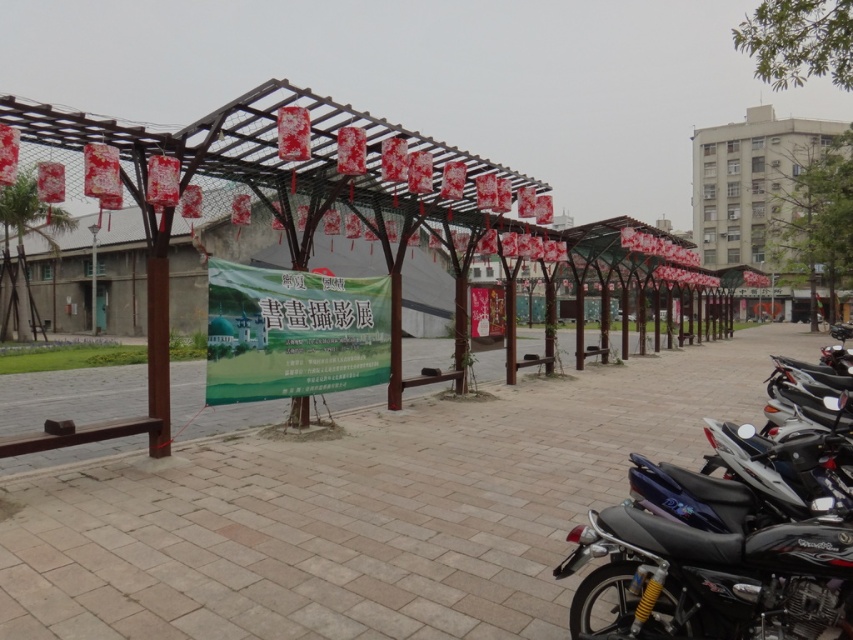
You are a photographer standing at the camera position. You want to take a photo of the black glossy motorcycle at right. Is the motorcycle within your reach to adjust its position before taking the photo?

The black glossy motorcycle at right is 7.38 feet away from the camera. Since this distance is within a typical comfortable reaching range for most people, you can likely adjust its position before taking the photo.

You are a photographer trying to capture both the black glossy motorcycle at right and the shiny black motorcycle at lower right in a single shot. Based on their positions, which motorcycle would appear closer to the camera in your photo?

The shiny black motorcycle at lower right would appear closer to the camera because it is positioned below the black glossy motorcycle at right, which is located above it.